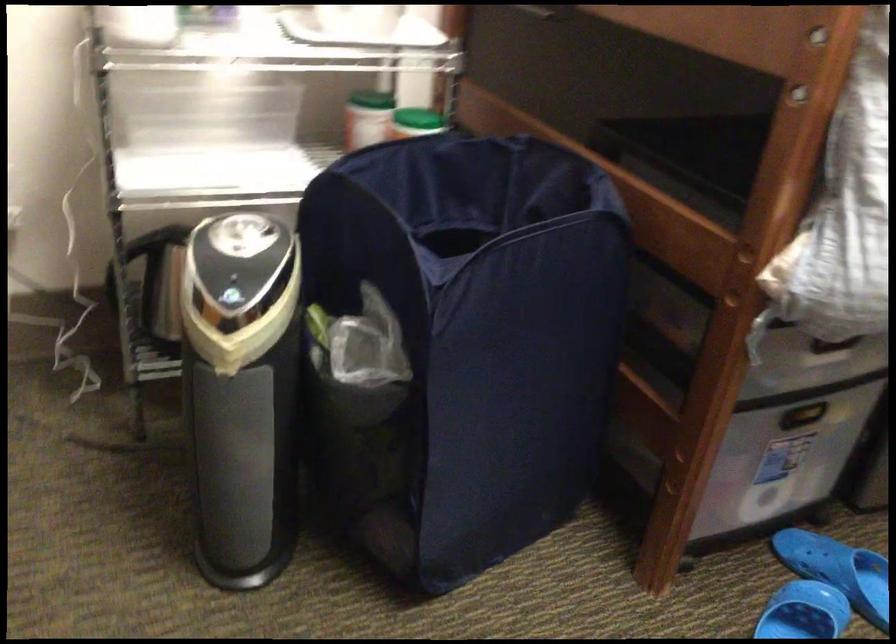
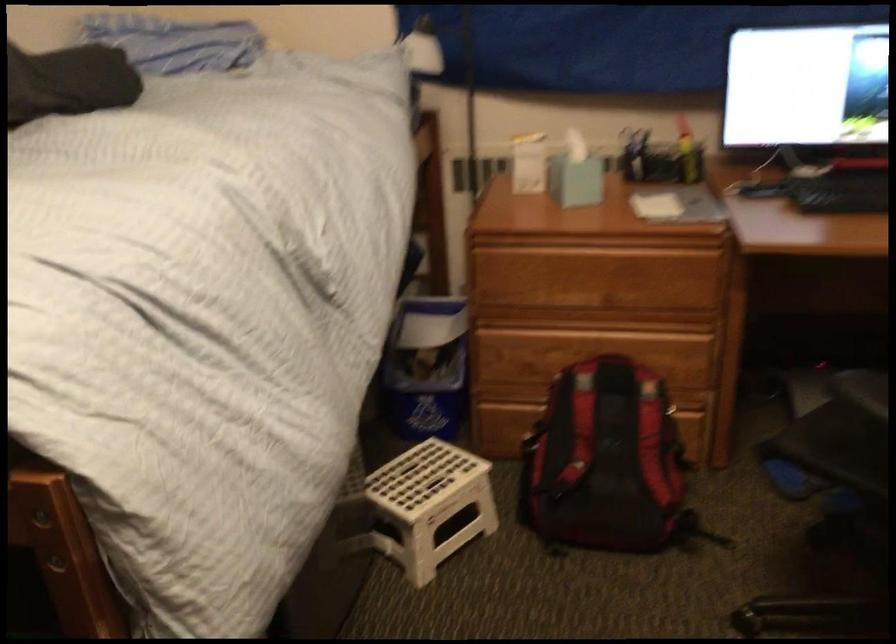
Question: The camera is either moving clockwise (left) or counter-clockwise (right) around the object. The first image is from the beginning of the video and the second image is from the end. Is the camera moving left or right when shooting the video?

Choices:
 (A) Left
 (B) Right

Answer: (A)